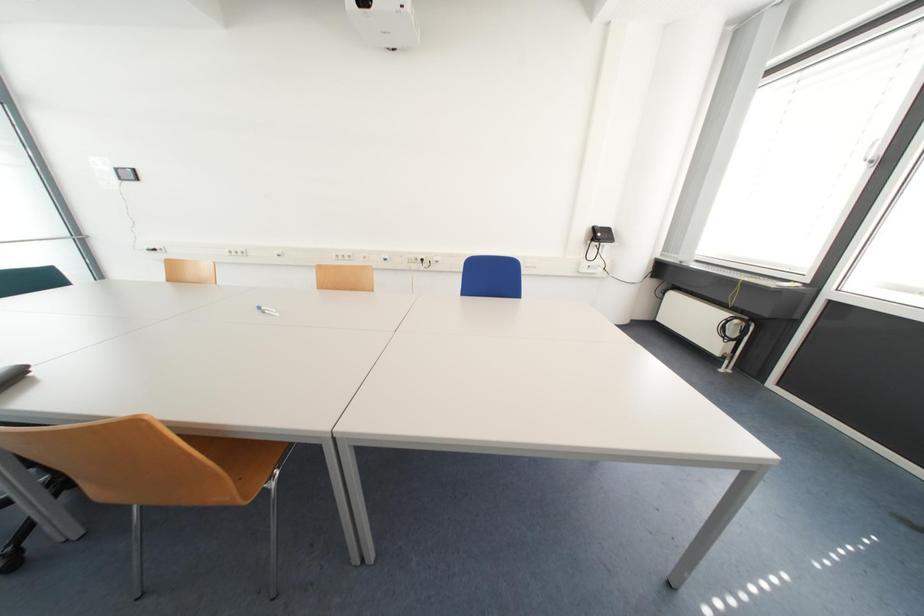
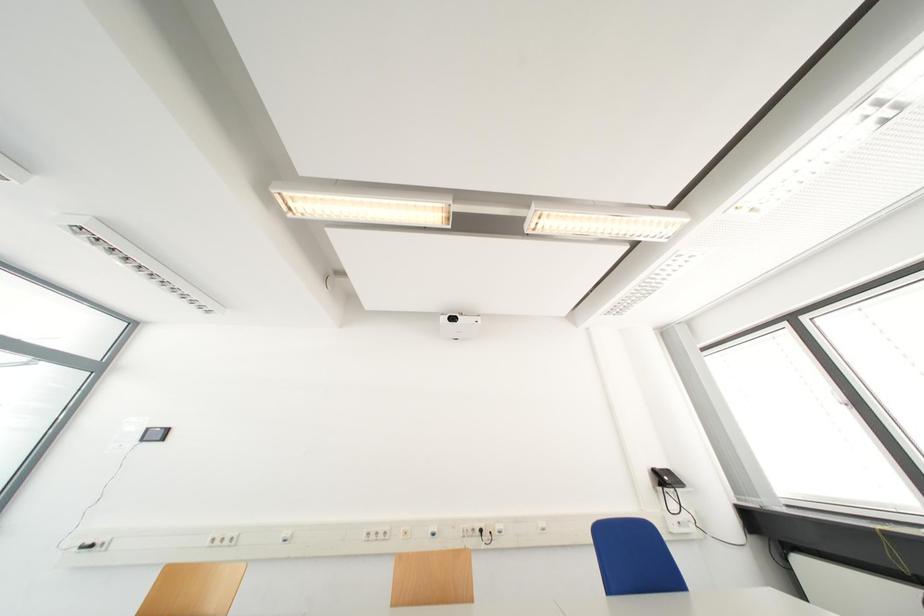
Question: The images are taken continuously from a first-person perspective. In which direction is your viewpoint rotating?

Choices:
 (A) Left
 (B) Right
 (C) Up
 (D) Down

Answer: (C)